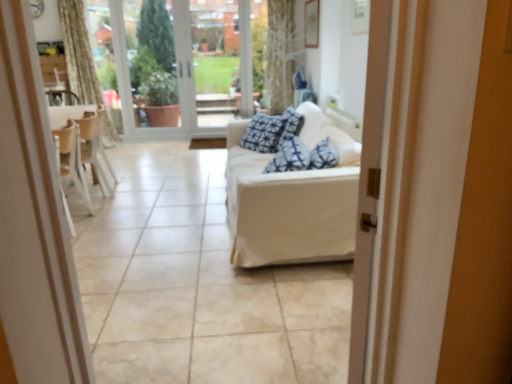
Find the location of `vacant space in between white fabric couch at center and wooden chair at left`. vacant space in between white fabric couch at center and wooden chair at left is located at coordinates (166, 210).